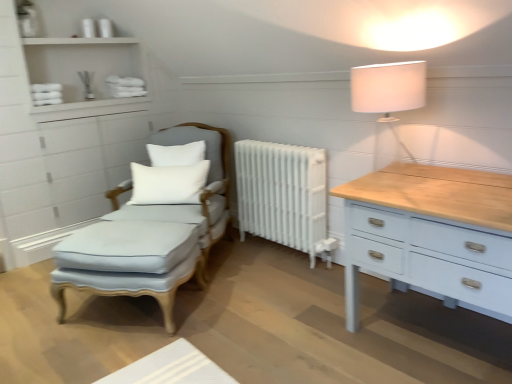
The height and width of the screenshot is (384, 512). I want to click on vacant space in light blue fabric footrest at center (from a real-world perspective), so click(x=141, y=308).